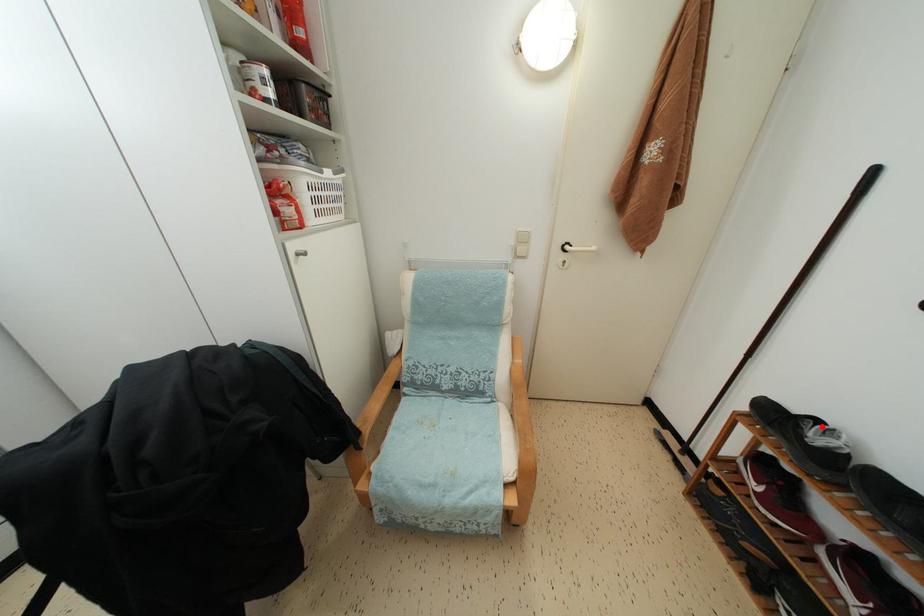
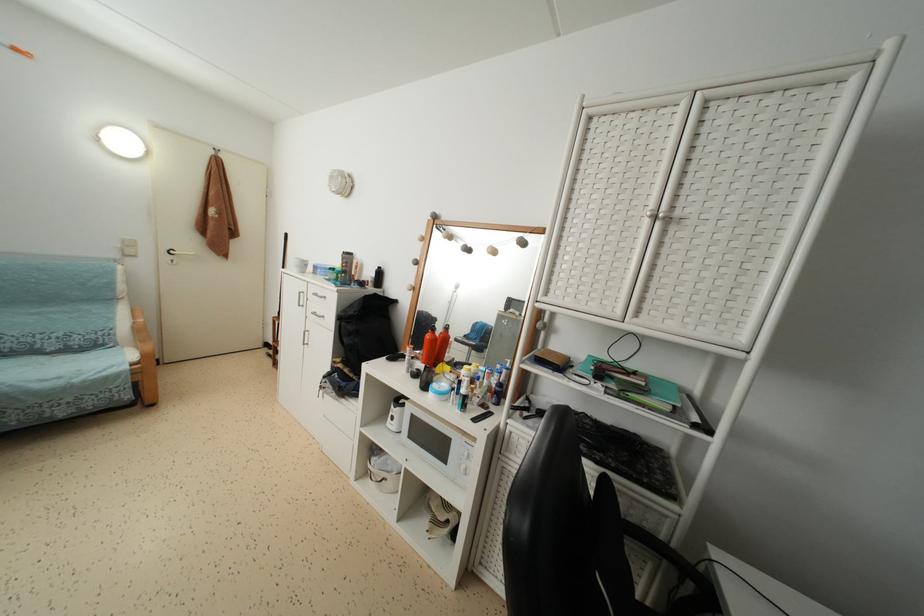
Question: I am providing you with two images of the same scene from different viewpoints. A red point is marked on the first image. Can you still see the location of the red point in image 2?

Choices:
 (A) Yes
 (B) No

Answer: (B)